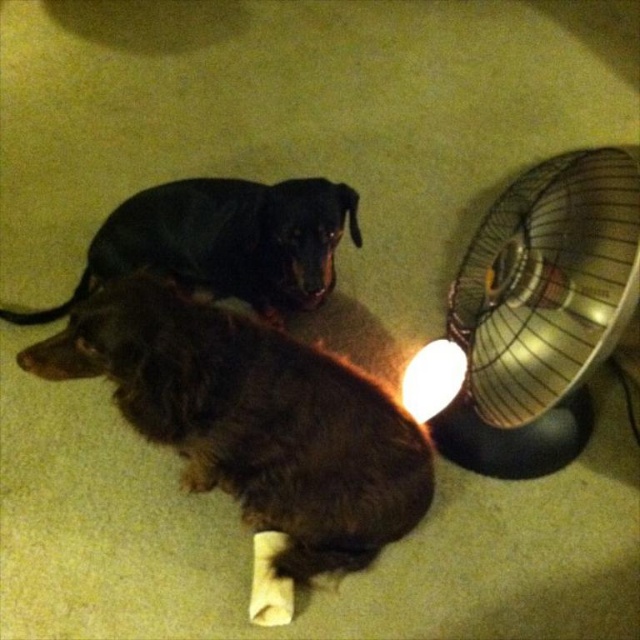
Question: Does metallic gold fan at right have a lesser width compared to black smooth dog at upper center?

Choices:
 (A) no
 (B) yes

Answer: (B)

Question: Among these objects, which one is farthest from the camera?

Choices:
 (A) metallic gold fan at right
 (B) brown fuzzy dog at lower left

Answer: (A)

Question: Considering the real-world distances, which object is farthest from the white glossy lampshade at lower right?

Choices:
 (A) black smooth dog at upper center
 (B) brown fuzzy dog at lower left

Answer: (A)

Question: Is brown fuzzy dog at lower left thinner than black smooth dog at upper center?

Choices:
 (A) no
 (B) yes

Answer: (B)

Question: Can you confirm if brown fuzzy dog at lower left is positioned below black smooth dog at upper center?

Choices:
 (A) no
 (B) yes

Answer: (B)

Question: Which is farther from the brown fuzzy dog at lower left?

Choices:
 (A) white glossy lampshade at lower right
 (B) black smooth dog at upper center
 (C) metallic gold fan at right

Answer: (C)